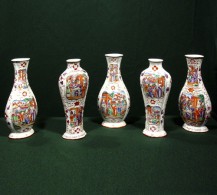
The image size is (217, 195). What are the coordinates of `vase with widest part at top` in the screenshot? It's located at (76, 83), (160, 80), (156, 87).